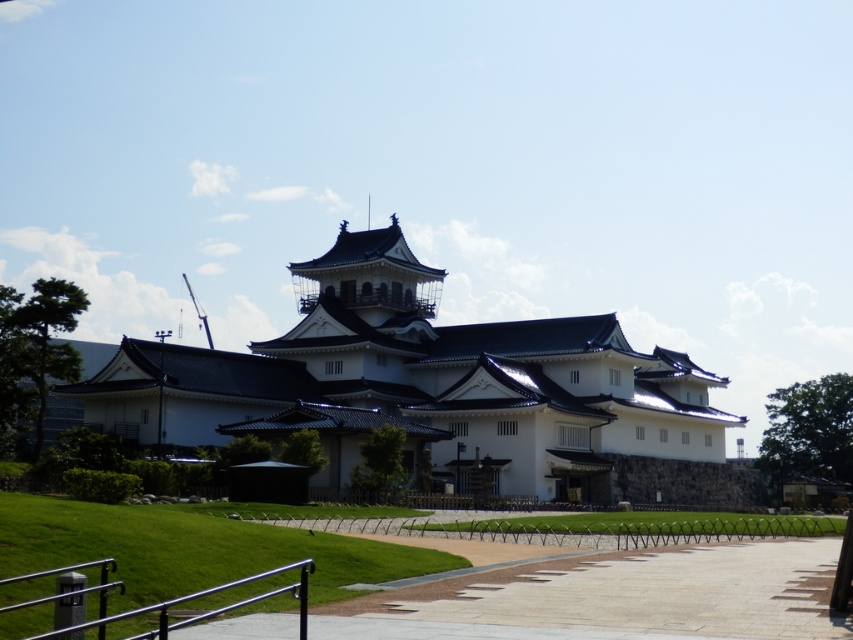
Is white matte building at center wider than paved concrete path at center?

Correct, the width of white matte building at center exceeds that of paved concrete path at center.

Between white matte building at center and paved concrete path at center, which one appears on the right side from the viewer's perspective?

Positioned to the right is paved concrete path at center.

Who is more distant from viewer, (418, 429) or (787, 592)?

Positioned behind is point (418, 429).

Locate an element on the screen. Image resolution: width=853 pixels, height=640 pixels. white matte building at center is located at coordinates (421, 381).